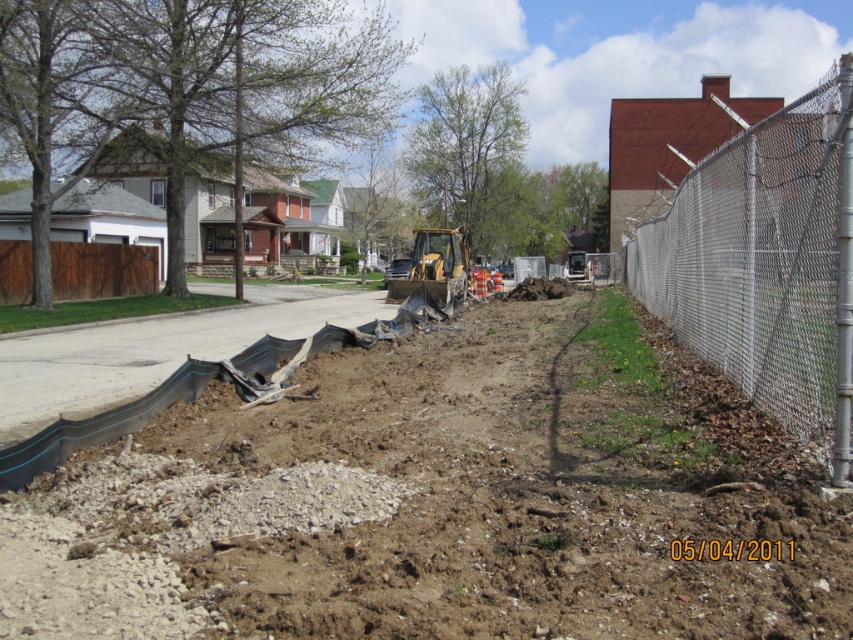
Question: Considering the real-world distances, which object is closest to the yellow-green rubber excavator at center?

Choices:
 (A) white chain-link fence at right
 (B) brown soil at center

Answer: (A)

Question: Which point is farther to the camera?

Choices:
 (A) (791, 305)
 (B) (463, 228)

Answer: (B)

Question: Does white chain-link fence at right appear on the right side of yellow-green rubber excavator at center?

Choices:
 (A) no
 (B) yes

Answer: (B)

Question: Is white chain-link fence at right positioned before yellow-green rubber excavator at center?

Choices:
 (A) no
 (B) yes

Answer: (B)

Question: Does brown soil at center have a lesser width compared to yellow-green rubber excavator at center?

Choices:
 (A) no
 (B) yes

Answer: (A)

Question: Among these objects, which one is nearest to the camera?

Choices:
 (A) white chain-link fence at right
 (B) brown soil at center
 (C) yellow-green rubber excavator at center

Answer: (B)